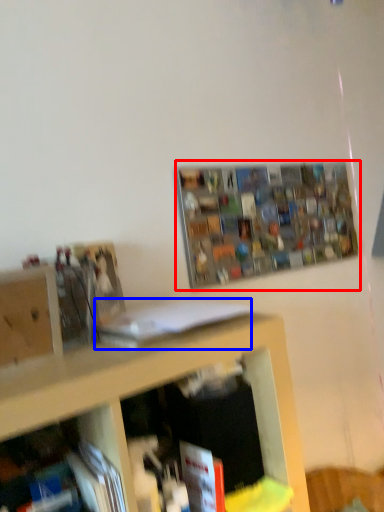
Question: Which point is further to the camera, shelf (highlighted by a red box) or book (highlighted by a blue box)?

Choices:
 (A) shelf
 (B) book

Answer: (A)